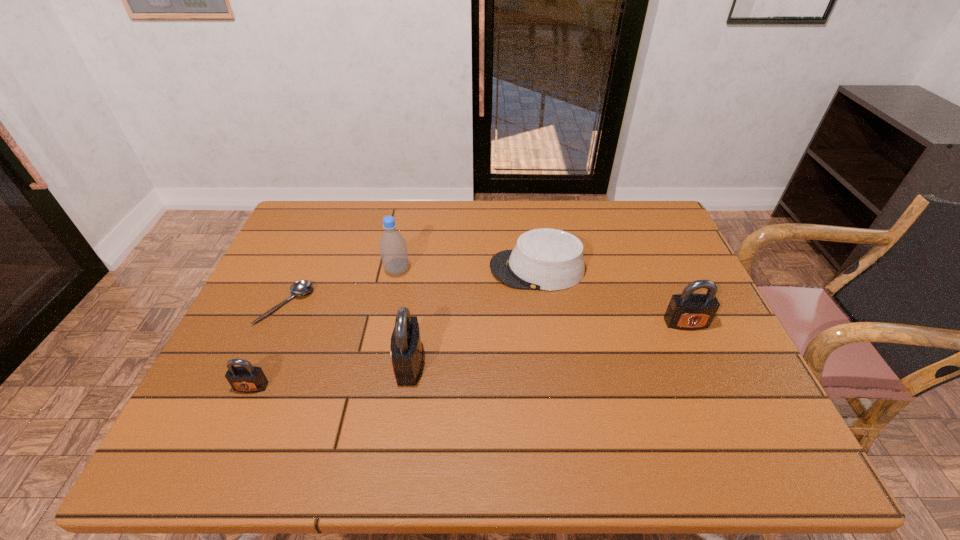
This screenshot has width=960, height=540. What are the coordinates of `free space that satisfies the following two spatial constraints: 1. on the front of the farthest padlock near the keyhole; 2. on the front of the second padlock from right to left near the keyhole` in the screenshot? It's located at (704, 363).

Image resolution: width=960 pixels, height=540 pixels. I want to click on vacant region that satisfies the following two spatial constraints: 1. on the front of the farthest padlock near the keyhole; 2. on the front of the second padlock from left to right near the keyhole, so click(704, 363).

Find the location of a particular element. Image resolution: width=960 pixels, height=540 pixels. free region that satisfies the following two spatial constraints: 1. on the back side of the third object from left to right; 2. on the right side of the shortest object is located at coordinates (301, 270).

You are a GUI agent. You are given a task and a screenshot of the screen. Output one action in this format:
    pyautogui.click(x=<x>, y=<y>)
    Task: Click on the vacant space that satisfies the following two spatial constraints: 1. on the front-facing side of the fifth object from left to right; 2. on the front of the leftmost padlock near the keyhole
    This screenshot has height=540, width=960.
    Given the screenshot: What is the action you would take?
    pyautogui.click(x=554, y=387)